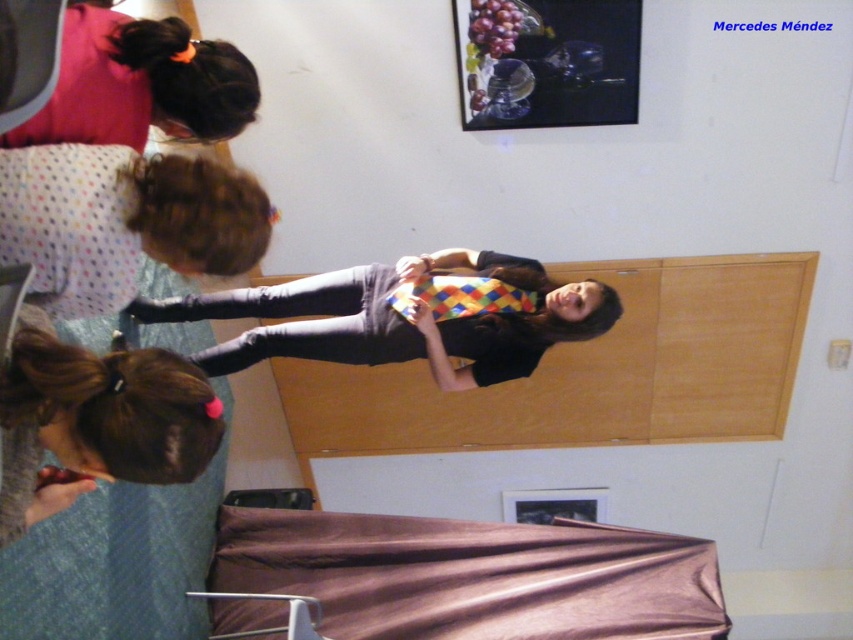
Looking at this image, is multicolored fabric tie at center taller than polka dot fabric at upper left?

Yes.

Looking at this image, which is more to the right, multicolored fabric tie at center or polka dot fabric at upper left?

multicolored fabric tie at center

Between point (433, 376) and point (155, 212), which one is positioned in front?

Point (155, 212) is in front.

Where is `multicolored fabric tie at center`? The width and height of the screenshot is (853, 640). multicolored fabric tie at center is located at coordinates (405, 316).

Is point (447, 556) behind point (502, 344)?

That is True.

Between brown satin bed at lower center and multicolored fabric tie at center, which one has more height?

Standing taller between the two is multicolored fabric tie at center.

Is point (402, 568) closer to viewer compared to point (489, 273)?

Yes.

Identify the location of brown satin bed at lower center. (473, 577).

The image size is (853, 640). What do you see at coordinates (405, 316) in the screenshot? I see `multicolored fabric tie at center` at bounding box center [405, 316].

Does multicolored fabric tie at center appear under brown hair at upper left?

Incorrect, multicolored fabric tie at center is not positioned below brown hair at upper left.

What are the coordinates of `multicolored fabric tie at center` in the screenshot? It's located at (405, 316).

Locate an element on the screen. This screenshot has width=853, height=640. multicolored fabric tie at center is located at coordinates pos(405,316).